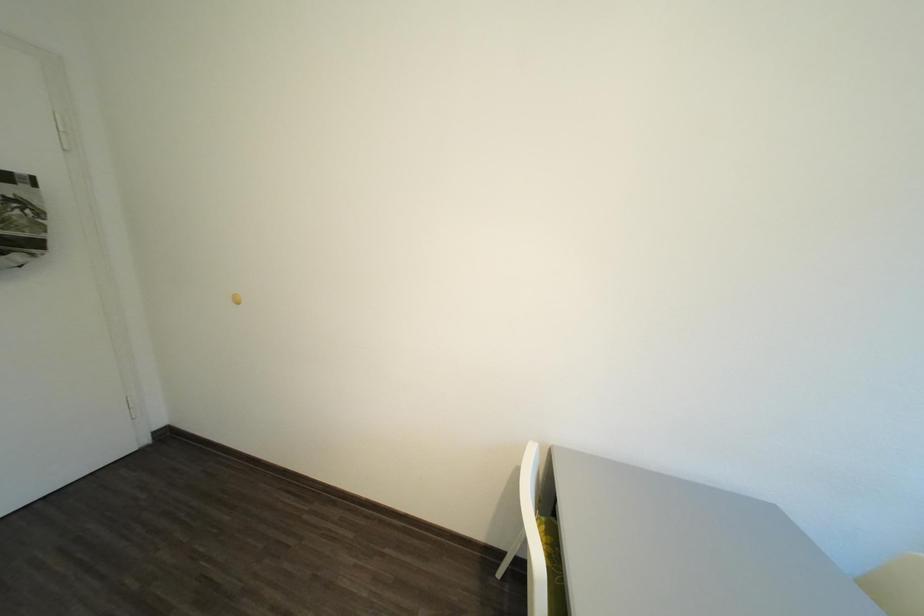
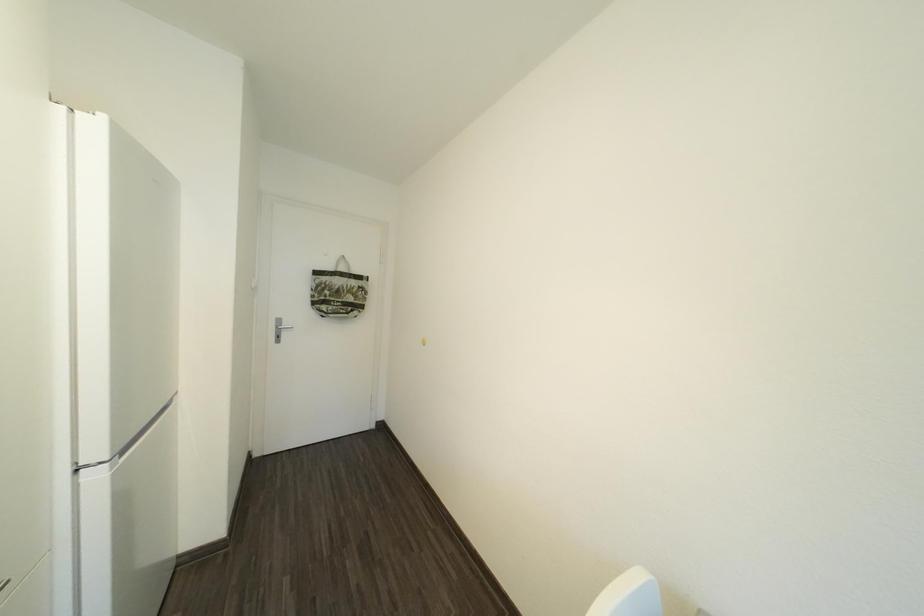
Question: The camera is either moving clockwise (left) or counter-clockwise (right) around the object. The first image is from the beginning of the video and the second image is from the end. Is the camera moving left or right when shooting the video?

Choices:
 (A) Left
 (B) Right

Answer: (B)